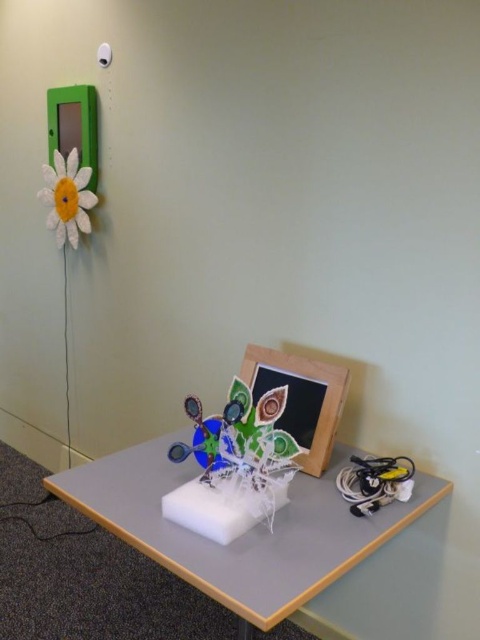
Question: Among these objects, which one is farthest from the camera?

Choices:
 (A) white fabric flower at upper left
 (B) wooden picture frame at center

Answer: (A)

Question: Is wooden picture frame at center positioned at the back of white fabric flower at upper left?

Choices:
 (A) yes
 (B) no

Answer: (B)

Question: Can you confirm if white foam block at center is positioned above wooden picture frame at center?

Choices:
 (A) no
 (B) yes

Answer: (A)

Question: Can you confirm if white foam block at center is thinner than wooden picture frame at center?

Choices:
 (A) yes
 (B) no

Answer: (B)

Question: Which point is farther from the camera taking this photo?

Choices:
 (A) (312, 396)
 (B) (294, 563)

Answer: (A)

Question: Which point is closer to the camera taking this photo?

Choices:
 (A) (317, 410)
 (B) (181, 480)

Answer: (B)